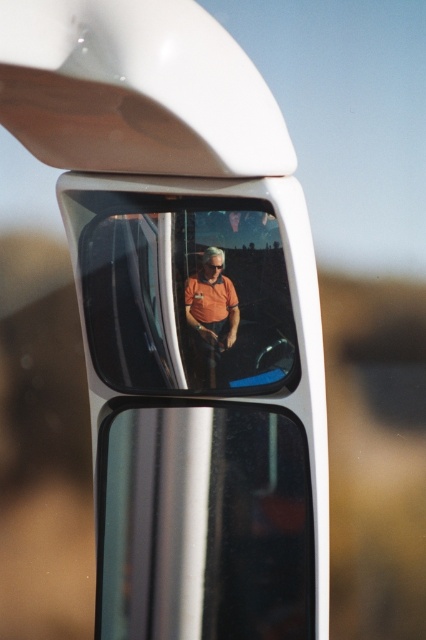
In the scene shown: Is matte orange shirt at center taller than orange matte shirt at center?

Indeed, matte orange shirt at center has a greater height compared to orange matte shirt at center.

Who is more distant from viewer, [196,330] or [199,369]?

Positioned behind is point [199,369].

Identify the location of matte orange shirt at center. Image resolution: width=426 pixels, height=640 pixels. (184, 292).